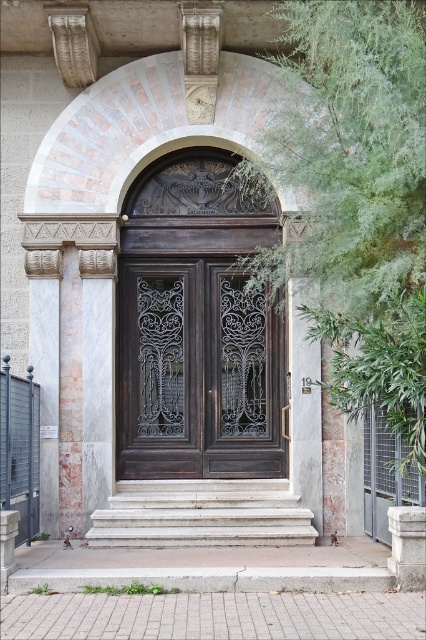
Question: Does dark wood door at center appear under white marble column at left?

Choices:
 (A) yes
 (B) no

Answer: (B)

Question: Is white marble stairs at center positioned before white marble column at left?

Choices:
 (A) no
 (B) yes

Answer: (B)

Question: Which point is farther from the camera taking this photo?

Choices:
 (A) (160, 486)
 (B) (60, 460)
 (C) (193, 273)

Answer: (C)

Question: Is the position of dark wood door at center more distant than that of white marble column at left?

Choices:
 (A) yes
 (B) no

Answer: (A)

Question: Which object is positioned farthest from the white marble stairs at center?

Choices:
 (A) white marble column at left
 (B) dark wood door at center

Answer: (A)

Question: Which point is closer to the camera?

Choices:
 (A) white marble stairs at center
 (B) white marble column at left
 (C) dark wood door at center

Answer: (A)